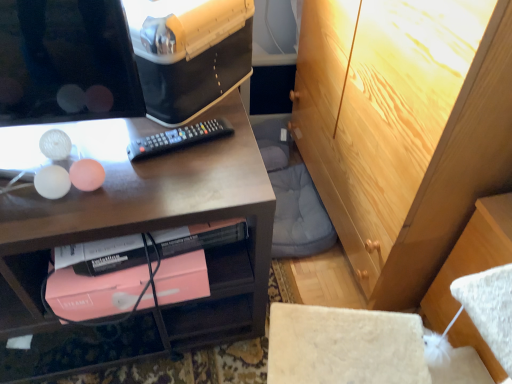
Question: From the image's perspective, is light brown wood cabinet at upper right below pink matte book at lower center?

Choices:
 (A) no
 (B) yes

Answer: (A)

Question: From a real-world perspective, is light brown wood cabinet at upper right positioned under pink matte book at lower center based on gravity?

Choices:
 (A) yes
 (B) no

Answer: (A)

Question: Is light brown wood cabinet at upper right next to pink matte book at lower center and touching it?

Choices:
 (A) no
 (B) yes

Answer: (A)

Question: Could pink matte book at lower center be considered to be inside light brown wood cabinet at upper right?

Choices:
 (A) no
 (B) yes

Answer: (A)

Question: Considering the relative sizes of light brown wood cabinet at upper right and pink matte book at lower center in the image provided, is light brown wood cabinet at upper right bigger than pink matte book at lower center?

Choices:
 (A) no
 (B) yes

Answer: (B)

Question: Considering the positions of point (108, 301) and point (207, 125), is point (108, 301) closer or farther from the camera than point (207, 125)?

Choices:
 (A) farther
 (B) closer

Answer: (B)

Question: Based on their positions, is pink matte book at lower center located to the left or right of black plastic remote at center?

Choices:
 (A) right
 (B) left

Answer: (B)

Question: From the image's perspective, is pink matte book at lower center above or below black plastic remote at center?

Choices:
 (A) above
 (B) below

Answer: (B)

Question: From a real-world perspective, is pink matte book at lower center above or below black plastic remote at center?

Choices:
 (A) below
 (B) above

Answer: (A)

Question: Is pink matte book at lower center wider or thinner than light brown wood cabinet at upper right?

Choices:
 (A) thin
 (B) wide

Answer: (A)

Question: Considering the positions of point (80, 278) and point (359, 180), is point (80, 278) closer or farther from the camera than point (359, 180)?

Choices:
 (A) farther
 (B) closer

Answer: (B)

Question: Is pink matte book at lower center bigger or smaller than light brown wood cabinet at upper right?

Choices:
 (A) small
 (B) big

Answer: (A)

Question: From their relative heights in the image, would you say pink matte book at lower center is taller or shorter than light brown wood cabinet at upper right?

Choices:
 (A) tall
 (B) short

Answer: (B)

Question: Is point (174, 142) positioned closer to the camera than point (338, 36)?

Choices:
 (A) farther
 (B) closer

Answer: (B)

Question: In the image, is black plastic remote at center positioned in front of or behind light brown wood cabinet at upper right?

Choices:
 (A) front
 (B) behind

Answer: (B)